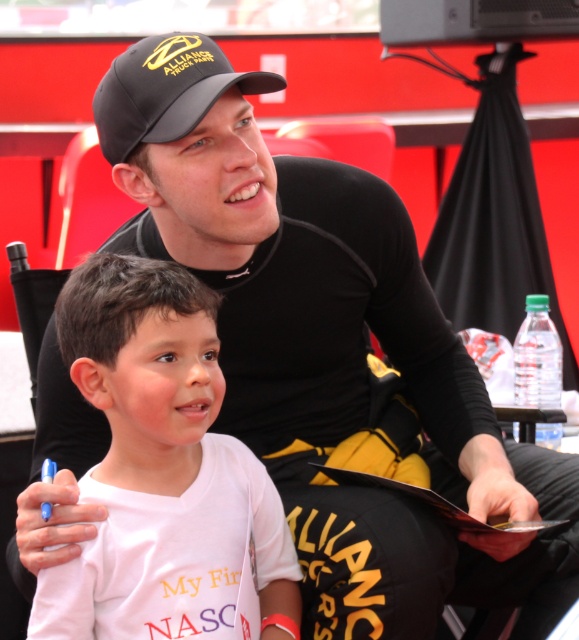
Is white cotton shirt at lower left shorter than black matte baseball cap at upper center?

No, white cotton shirt at lower left is not shorter than black matte baseball cap at upper center.

Is white cotton shirt at lower left smaller than black matte baseball cap at upper center?

No.

Locate an element on the screen. The height and width of the screenshot is (640, 579). white cotton shirt at lower left is located at coordinates (160, 468).